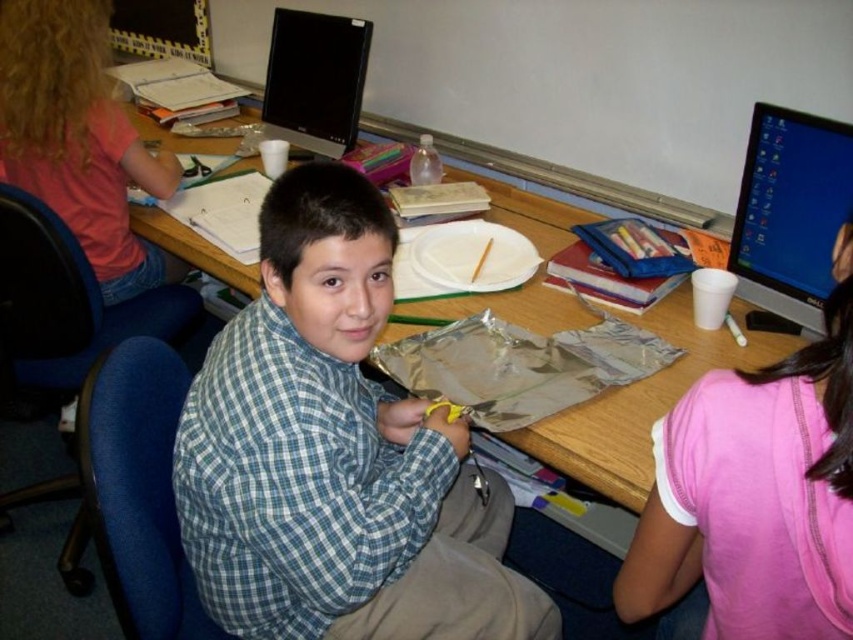
In the classroom scene, there is a blue plaid shirt at center and a pink fabric shirt at upper right. From the perspective of someone standing in front of the classroom, which shirt is positioned more to the left?

The blue plaid shirt at center is positioned more to the left than the pink fabric shirt at upper right.

Based on the photo, you are a student in the classroom and want to place a large textbook on the wooden desk at center without blocking the matte black monitor at upper right. Is the desk positioned in a way that allows this?

The wooden desk at center is located below the matte black monitor at upper right, so placing the textbook on the desk should not block the monitor since it is positioned lower.